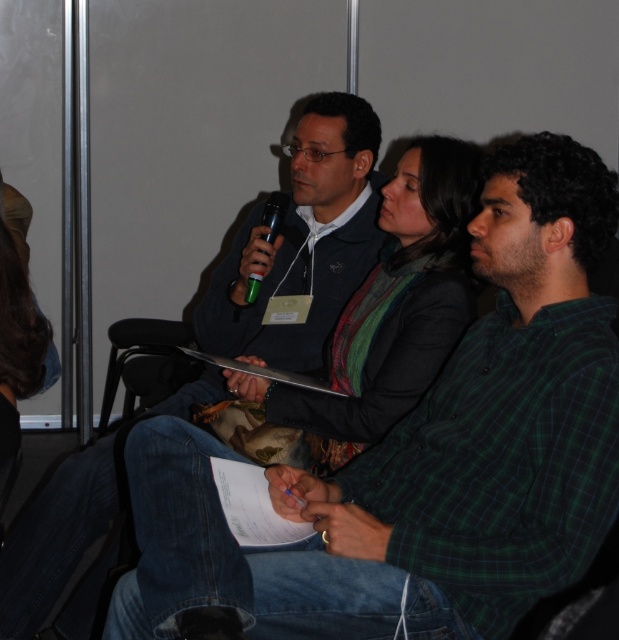
You are a photographer trying to focus on two points in the image, point (504,337) and point (271,204). Which point should you focus on first if you want to capture both in sharp detail?

Point (504,337) is closer to the camera than point (271,204), so you should focus on point (504,337) first to ensure both are in sharp detail.

From the picture: In the scene where a group is in a conference room, there is a green plaid shirt at center and a dark blue jeans at center. From the perspective of someone sitting at the front of the room, which item is positioned to the right?

The green plaid shirt at center is to the right of the dark blue jeans at center.

You are standing in the conference room and see the point marked at coordinates [526,156]. Can you reach it without moving your feet?

The point at [526,156] is 1.41 meters away from you, so yes, you can reach it without moving your feet since it is within arm reach.